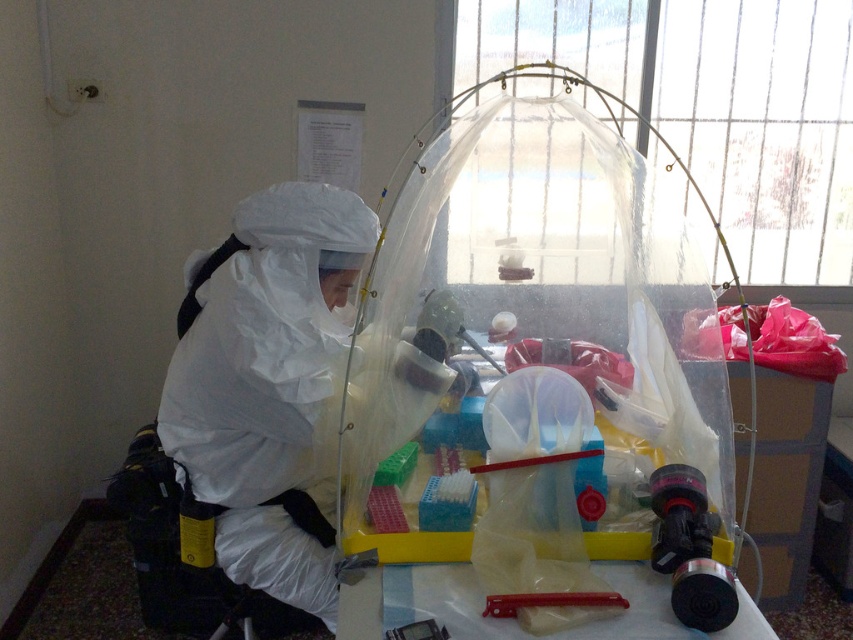
Does translucent plastic equipment at center appear on the left side of white matte/soft hazmat suit at center?

Incorrect, translucent plastic equipment at center is not on the left side of white matte/soft hazmat suit at center.

Does translucent plastic equipment at center have a greater width compared to white matte/soft hazmat suit at center?

Yes, translucent plastic equipment at center is wider than white matte/soft hazmat suit at center.

Does point (519, 230) lie in front of point (314, 532)?

That is False.

In order to click on translucent plastic equipment at center in this screenshot , I will do `click(543, 371)`.